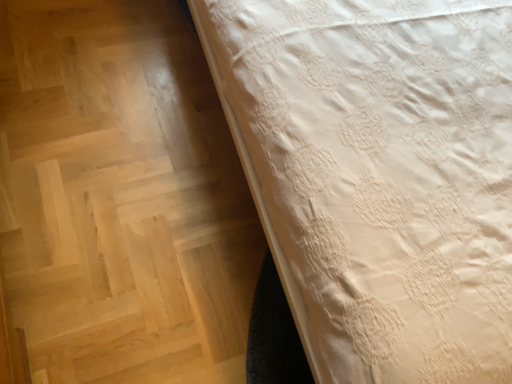
In order to face white lace bed at upper right, should I rotate leftwards or rightwards?

A 29.681 degree turn to the right will do.

Find the location of a particular element. white lace bed at upper right is located at coordinates (380, 176).

The height and width of the screenshot is (384, 512). Describe the element at coordinates (380, 176) in the screenshot. I see `white lace bed at upper right` at that location.

Locate an element on the screen. white lace bed at upper right is located at coordinates (380, 176).